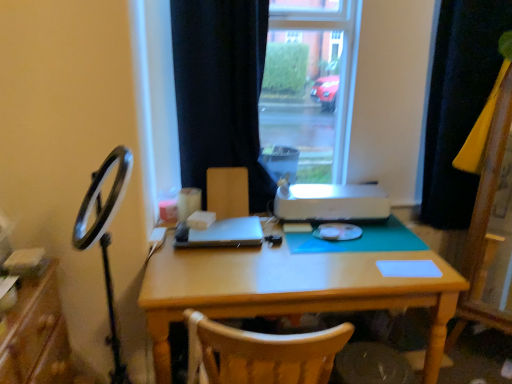
You are a GUI agent. You are given a task and a screenshot of the screen. Output one action in this format:
    pyautogui.click(x=<x>, y=<y>)
    Task: Click on the free spot to the left of white matte notepad at center
    This screenshot has width=512, height=384.
    Given the screenshot: What is the action you would take?
    pyautogui.click(x=358, y=265)